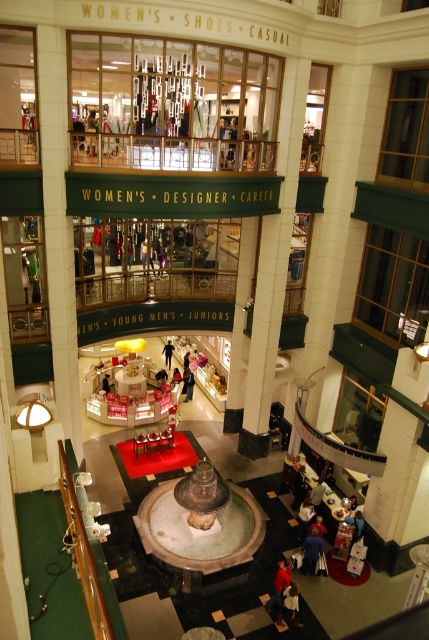
Question: Does matte black jacket at center have a lesser width compared to white fabric person at center?

Choices:
 (A) no
 (B) yes

Answer: (A)

Question: Estimate the real-world distances between objects in this image. Which object is farther from the matte black jacket at center?

Choices:
 (A) polished bronze fountain at center
 (B) dark blue jeans at lower right
 (C) white fabric person at center

Answer: (B)

Question: Based on their relative distances, which object is farther from the matte black jacket at center?

Choices:
 (A) polished bronze fountain at center
 (B) white fabric person at center
 (C) dark blue jeans at lower right

Answer: (C)

Question: Can you confirm if polished bronze fountain at center is positioned to the right of white fabric person at center?

Choices:
 (A) no
 (B) yes

Answer: (B)

Question: Which point appears closest to the camera in this image?

Choices:
 (A) (189, 396)
 (B) (316, 557)
 (C) (171, 349)

Answer: (B)

Question: Is the position of polished bronze fountain at center less distant than that of matte black jacket at center?

Choices:
 (A) no
 (B) yes

Answer: (B)